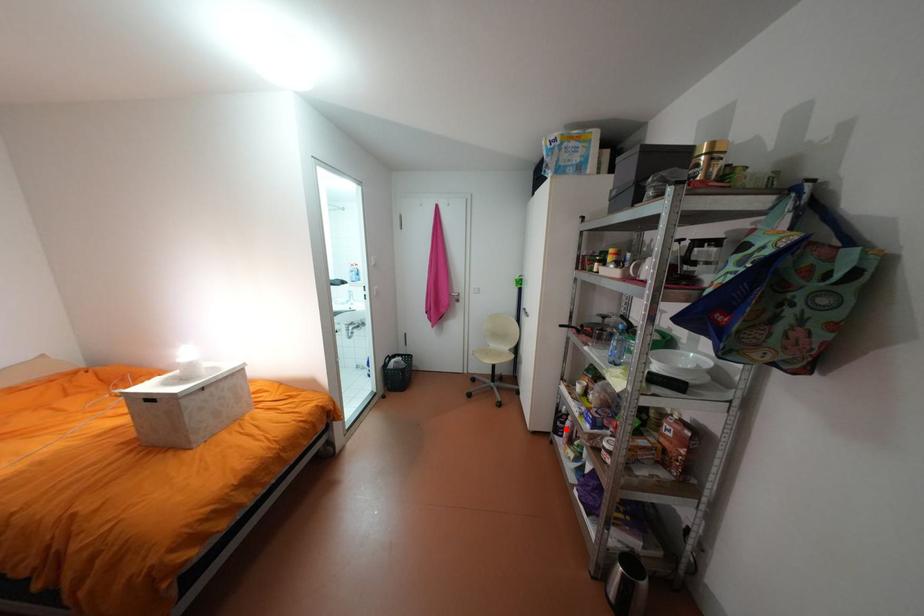
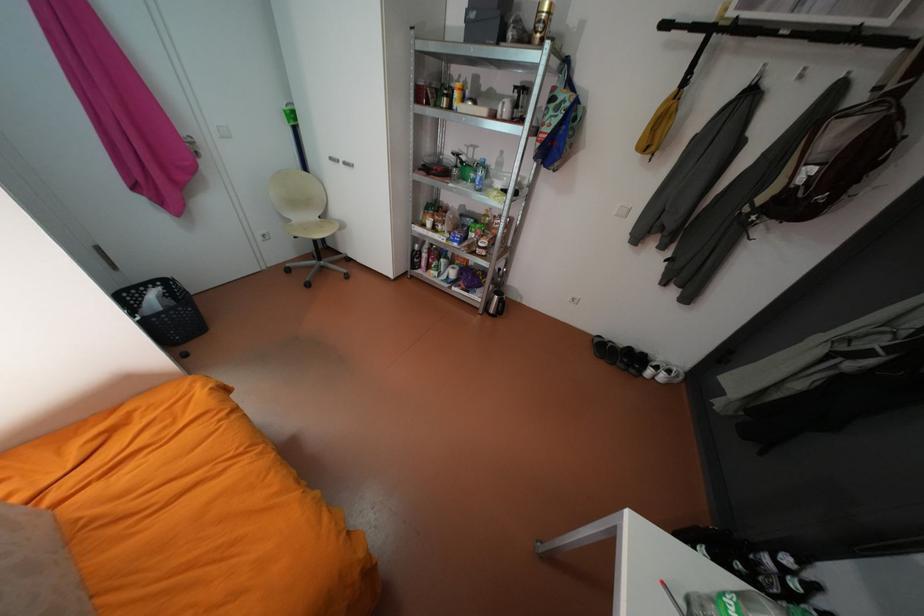
Find the pixel in the second image that matches the highlighted location in the first image.

(423, 265)